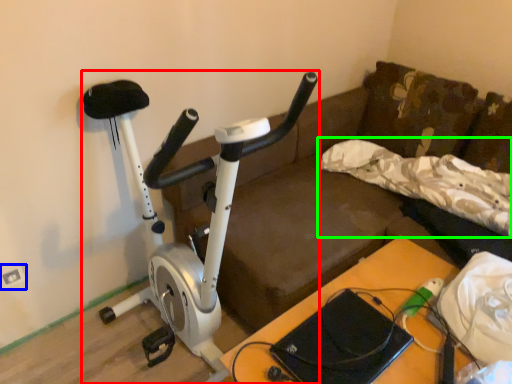
Question: Which is farther away from stationary bicycle (highlighted by a red box)? electric outlet (highlighted by a blue box) or pillow (highlighted by a green box)?

Choices:
 (A) electric outlet
 (B) pillow

Answer: (B)